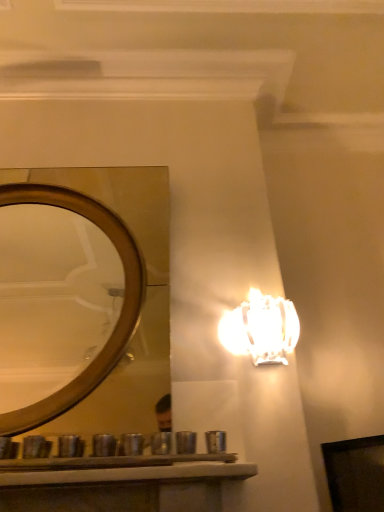
Find the location of a particular element. The height and width of the screenshot is (512, 384). wooden mirror at center is located at coordinates (142, 301).

Image resolution: width=384 pixels, height=512 pixels. What do you see at coordinates (142, 301) in the screenshot?
I see `wooden mirror at center` at bounding box center [142, 301].

Locate an element on the screen. white glossy lamp at upper right is located at coordinates (261, 329).

Describe the element at coordinates (261, 329) in the screenshot. The image size is (384, 512). I see `white glossy lamp at upper right` at that location.

Image resolution: width=384 pixels, height=512 pixels. I want to click on wooden mirror at center, so click(x=142, y=301).

Which object is positioned more to the right, wooden mirror at center or white glossy lamp at upper right?

white glossy lamp at upper right.

Which object is further away from the camera, wooden mirror at center or white glossy lamp at upper right?

white glossy lamp at upper right is further from the camera.

Is point (166, 250) positioned in front of point (283, 325)?

No, it is not.

From the image's perspective, does wooden mirror at center appear lower than white glossy lamp at upper right?

No.

From a real-world perspective, which object stands above the other?

wooden mirror at center is physically above.

Which object is wider, wooden mirror at center or white glossy lamp at upper right?

wooden mirror at center.

Considering the relative sizes of wooden mirror at center and white glossy lamp at upper right in the image provided, is wooden mirror at center taller than white glossy lamp at upper right?

Yes, wooden mirror at center is taller than white glossy lamp at upper right.

Based on their sizes in the image, would you say wooden mirror at center is bigger or smaller than white glossy lamp at upper right?

Clearly, wooden mirror at center is larger in size than white glossy lamp at upper right.

Is white glossy lamp at upper right inside wooden mirror at center?

No.

Is wooden mirror at center next to white glossy lamp at upper right?

There is a gap between wooden mirror at center and white glossy lamp at upper right.

Could you tell me if wooden mirror at center is facing white glossy lamp at upper right?

No.

In the scene shown: How many degrees apart are the facing directions of wooden mirror at center and white glossy lamp at upper right?

The facing directions of wooden mirror at center and white glossy lamp at upper right are 0.00103 degrees apart.

Image resolution: width=384 pixels, height=512 pixels. In order to click on mirror that is on the left side of white glossy lamp at upper right in this screenshot , I will do `click(142, 301)`.

Which is more to the left, white glossy lamp at upper right or wooden mirror at center?

wooden mirror at center is more to the left.

Considering the positions of objects white glossy lamp at upper right and wooden mirror at center in the image provided, who is in front, white glossy lamp at upper right or wooden mirror at center?

wooden mirror at center.

Does point (250, 340) appear closer or farther from the camera than point (147, 288)?

Point (250, 340) appears to be closer to the viewer than point (147, 288).

From the image's perspective, is white glossy lamp at upper right under wooden mirror at center?

Indeed, from the image's perspective, white glossy lamp at upper right is shown beneath wooden mirror at center.

From a real-world perspective, does white glossy lamp at upper right stand above wooden mirror at center?

No, from a real-world perspective, white glossy lamp at upper right is not on top of wooden mirror at center.

Considering the sizes of objects white glossy lamp at upper right and wooden mirror at center in the image provided, who is thinner, white glossy lamp at upper right or wooden mirror at center?

white glossy lamp at upper right is thinner.

Is white glossy lamp at upper right taller than wooden mirror at center?

No.

Which of these two, white glossy lamp at upper right or wooden mirror at center, is smaller?

Smaller between the two is white glossy lamp at upper right.

Could wooden mirror at center be considered to be inside white glossy lamp at upper right?

No, wooden mirror at center is not surrounded by white glossy lamp at upper right.

Is there a large distance between white glossy lamp at upper right and wooden mirror at center?

white glossy lamp at upper right is far away from wooden mirror at center.

Could you tell me if white glossy lamp at upper right is facing wooden mirror at center?

No, white glossy lamp at upper right is not aimed at wooden mirror at center.

How distant is white glossy lamp at upper right from wooden mirror at center?

The distance of white glossy lamp at upper right from wooden mirror at center is 1.38 meters.

The image size is (384, 512). In order to click on lamp located below the wooden mirror at center (from the image's perspective) in this screenshot , I will do `click(261, 329)`.

Where is `mirror above the white glossy lamp at upper right (from the image's perspective)`? This screenshot has width=384, height=512. mirror above the white glossy lamp at upper right (from the image's perspective) is located at coordinates (142, 301).

Where is `lamp below the wooden mirror at center (from the image's perspective)`? Image resolution: width=384 pixels, height=512 pixels. lamp below the wooden mirror at center (from the image's perspective) is located at coordinates (261, 329).